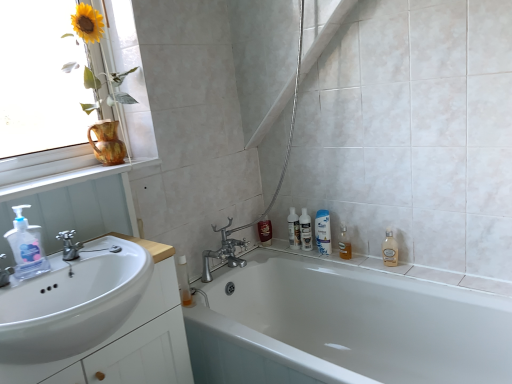
Question: Is translucent plastic bottles at center, the third toiletry viewed from the left, in front of or behind clear glass bottle at right, the first cleaning product when ordered from right to left, in the image?

Choices:
 (A) front
 (B) behind

Answer: (B)

Question: From the image's perspective, relative to clear glass bottle at right, the 2th cleaning product in the front-to-back sequence, is translucent plastic bottles at center, which appears as the first toiletry when viewed from the right, above or below?

Choices:
 (A) below
 (B) above

Answer: (B)

Question: Based on their relative distances, which object is farther from the clear plastic pump bottle at left, the 1th cleaning product when ordered from left to right?

Choices:
 (A) white wood window sill at upper left
 (B) matte ceramic vase at upper left
 (C) white glossy bottles at center, acting as the 2th toiletry starting from the right
 (D) white glossy bathtub at center
 (E) translucent plastic mouthwash at right, which is the first mouthwash in right-to-left order

Answer: (E)

Question: Which object is the closest to the clear glass bottle at right, positioned as the second cleaning product in left-to-right order?

Choices:
 (A) matte ceramic vase at upper left
 (B) shiny brown bottle at center, the first toiletry when ordered from left to right
 (C) white glossy sink at lower left
 (D) clear plastic pump bottle at left, positioned as the 2th cleaning product in back-to-front order
 (E) white glossy bathtub at center

Answer: (E)